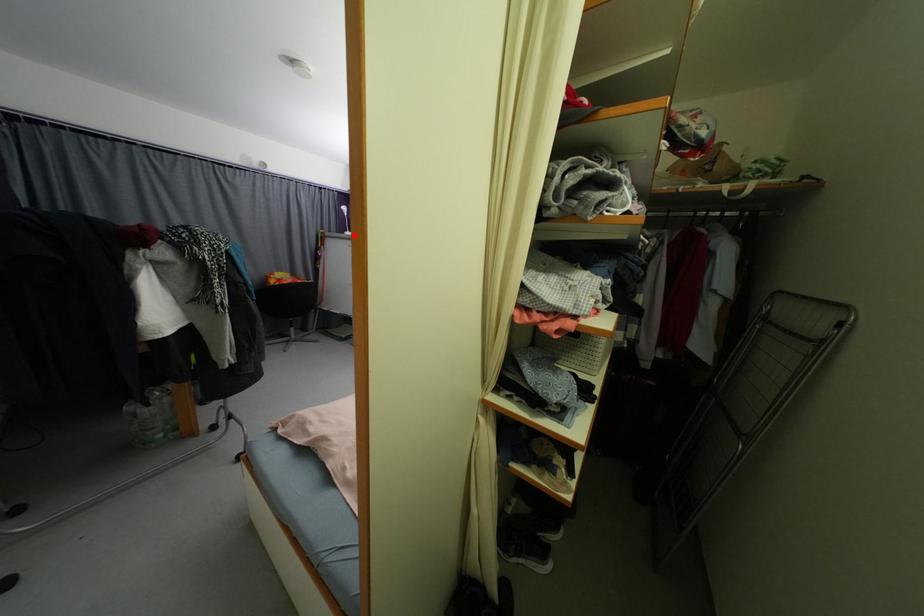
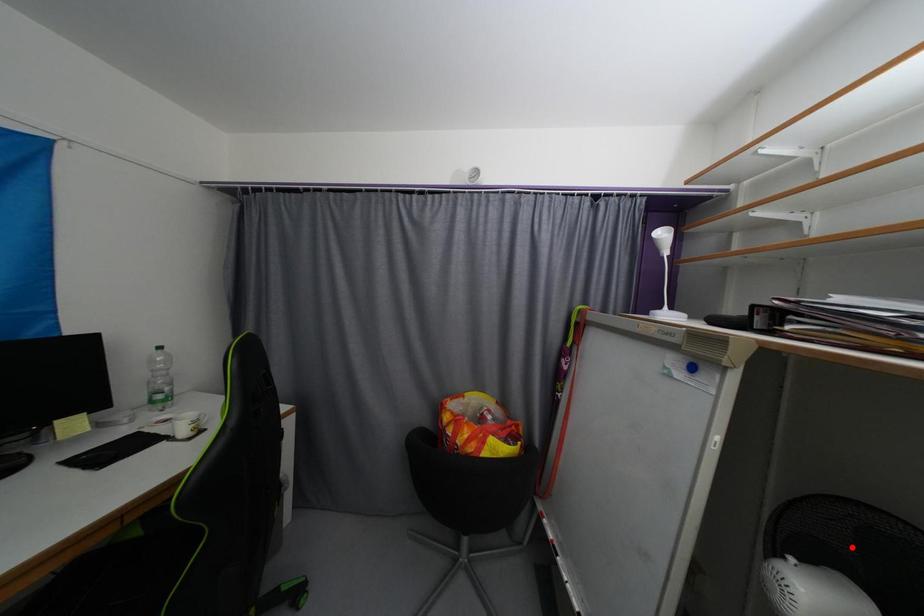
I am providing you with two images of the same scene from different viewpoints. A red point is marked on the first image and another point is marked on the second image. Do the highlighted points in image1 and image2 indicate the same real-world spot?

No